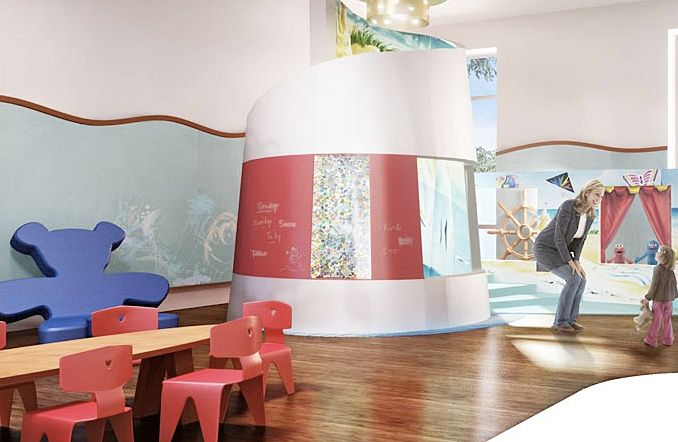
The height and width of the screenshot is (442, 678). What are the coordinates of `wooden table` in the screenshot? It's located at (165, 341), (28, 356).